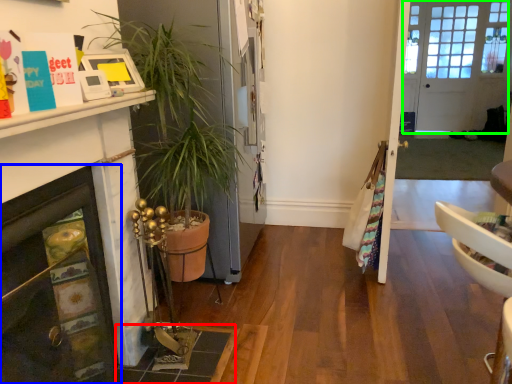
Question: Which object is positioned farthest from tile (highlighted by a red box)? Select from fireplace (highlighted by a blue box) and door (highlighted by a green box).

Choices:
 (A) fireplace
 (B) door

Answer: (B)